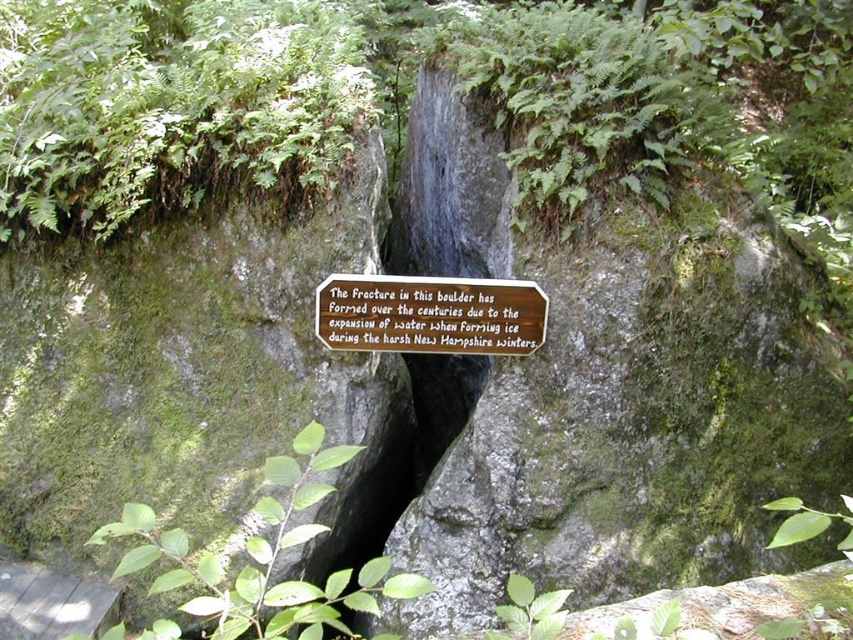
You are a geologist examining the green mossy rock at center and the bronze plaque at center. Which object is wider?

The green mossy rock at center is wider than the bronze plaque at center.

You are a geologist examining the green mossy rock at center and the bronze plaque at center. Which object would you need to use a magnifying glass on to observe the fine details of its surface texture?

The green mossy rock at center has a rough and uneven texture, so you would need to use a magnifying glass to observe its fine details. The bronze plaque at center likely has a smoother surface, making it easier to see without magnification.